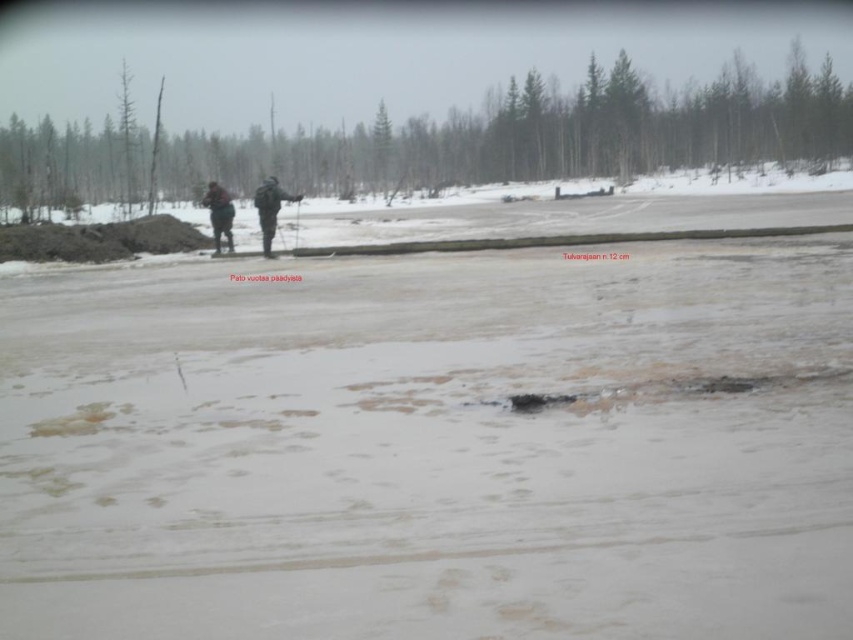
Is translucent ice at center smaller than brown leather jacket at upper center?

Indeed, translucent ice at center has a smaller size compared to brown leather jacket at upper center.

What do you see at coordinates (432, 448) in the screenshot? I see `translucent ice at center` at bounding box center [432, 448].

This screenshot has height=640, width=853. Find the location of `translucent ice at center`. translucent ice at center is located at coordinates (432, 448).

The image size is (853, 640). Describe the element at coordinates (270, 209) in the screenshot. I see `dark green camouflage jacket at center` at that location.

Does dark green camouflage jacket at center appear on the left side of brown leather jacket at upper center?

In fact, dark green camouflage jacket at center is to the right of brown leather jacket at upper center.

Measure the distance between point (268, 179) and camera.

A distance of 73.12 meters exists between point (268, 179) and camera.

Image resolution: width=853 pixels, height=640 pixels. What are the coordinates of `dark green camouflage jacket at center` in the screenshot? It's located at (270, 209).

Is point (274, 225) farther from viewer compared to point (258, 220)?

Yes.

The width and height of the screenshot is (853, 640). What are the coordinates of `dark gray jacket at center` in the screenshot? It's located at (270, 209).

Does point (270, 211) lie in front of point (264, 204)?

Yes, point (270, 211) is closer to viewer.

Find the location of a particular element. The image size is (853, 640). dark gray jacket at center is located at coordinates (270, 209).